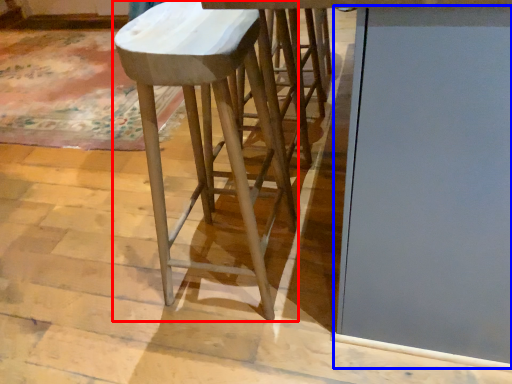
Question: Which point is closer to the camera, stool (highlighted by a red box) or glass door (highlighted by a blue box)?

Choices:
 (A) stool
 (B) glass door

Answer: (B)